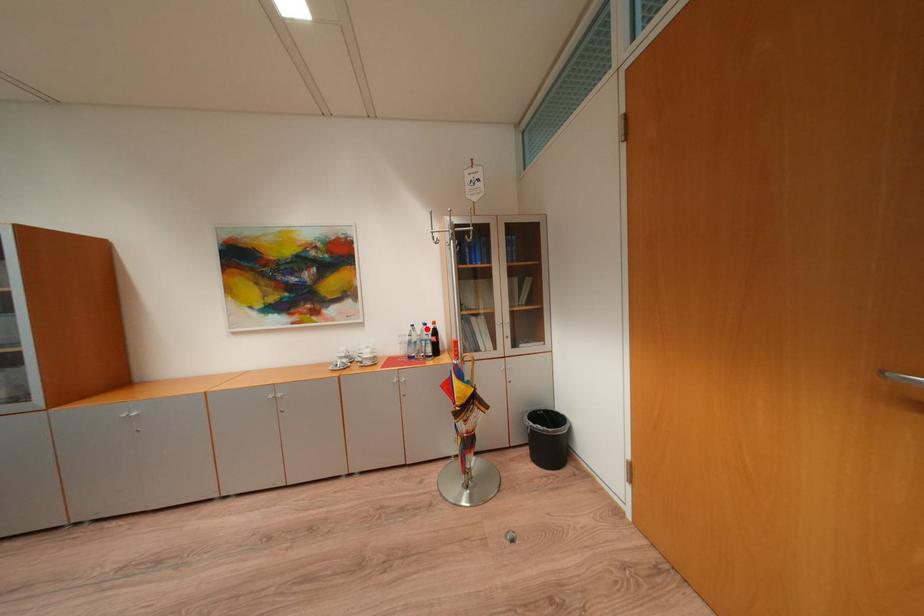
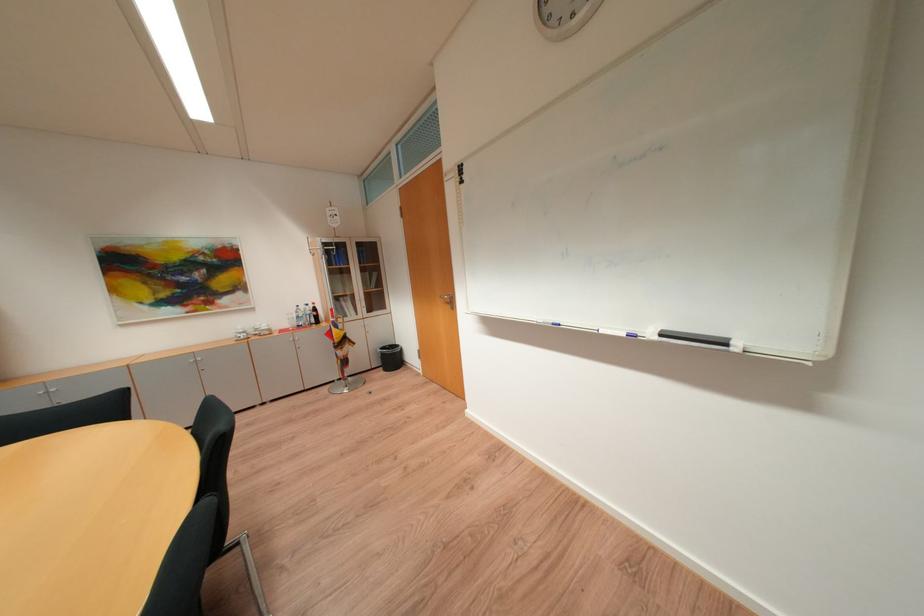
Question: A red point is marked in image1. In image2, is the corresponding 3D point closer to the camera or farther? Reply with the corresponding letter.

Choices:
 (A) The corresponding 3D point is closer.
 (B) The corresponding 3D point is farther.

Answer: (A)